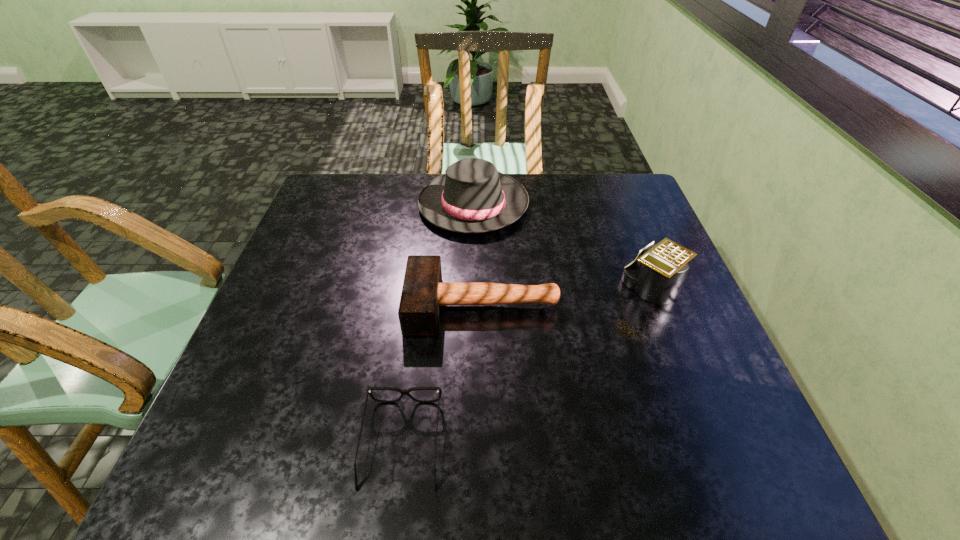
Where is `vacant region that satisfies the following two spatial constraints: 1. on the hammer head face of the mallet; 2. with the lenses facing outward on the spectacles`? This screenshot has width=960, height=540. vacant region that satisfies the following two spatial constraints: 1. on the hammer head face of the mallet; 2. with the lenses facing outward on the spectacles is located at coordinates (483, 443).